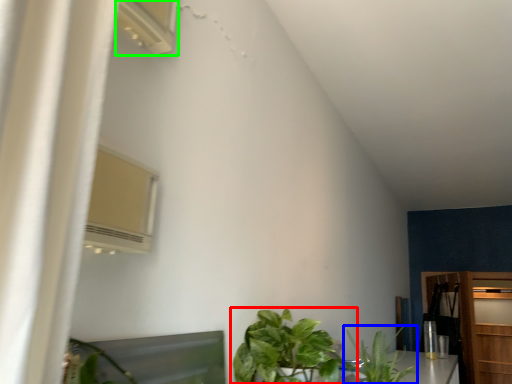
Question: Which object is the closest to the houseplant (highlighted by a red box)? Choose among these: houseplant (highlighted by a blue box) or air conditioner (highlighted by a green box).

Choices:
 (A) houseplant
 (B) air conditioner

Answer: (A)